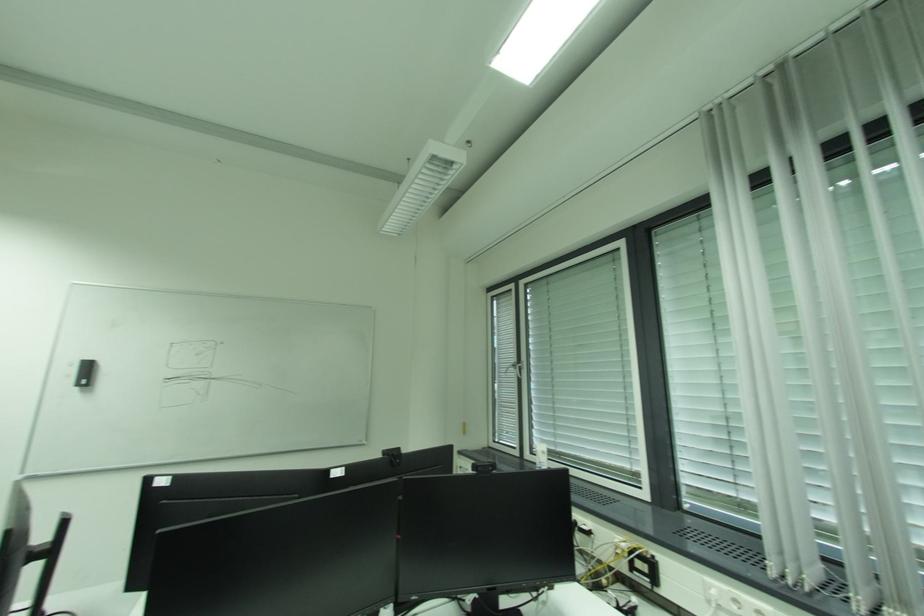
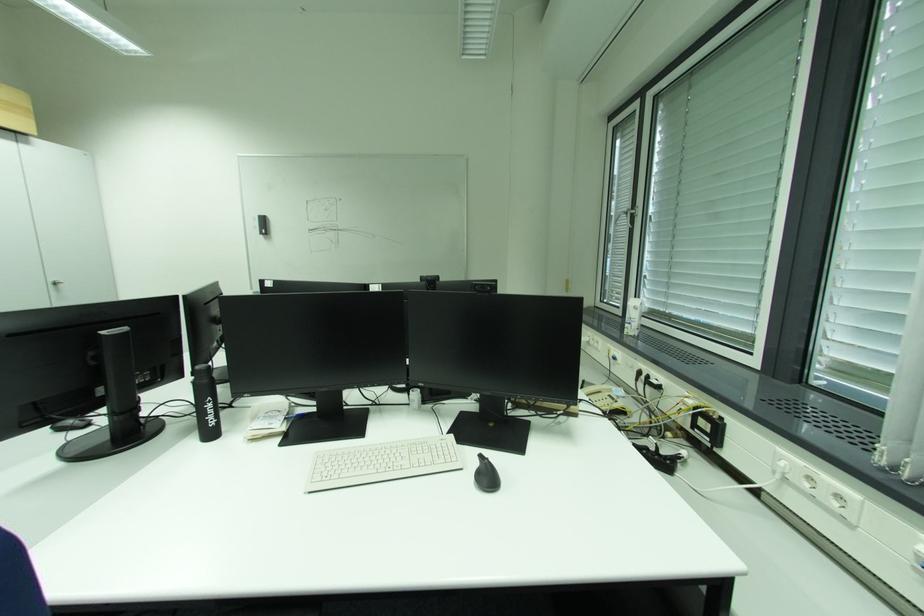
The first image is from the beginning of the video and the second image is from the end. How did the camera likely rotate when shooting the video?

The camera rotated toward left-down.